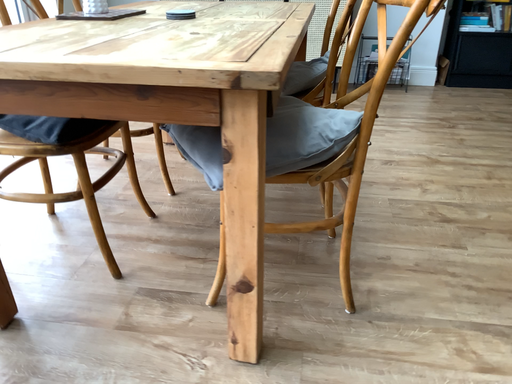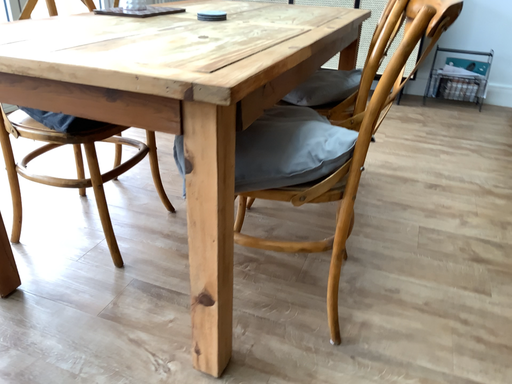
Question: How did the camera likely rotate when shooting the video?

Choices:
 (A) rotated right
 (B) rotated left

Answer: (B)